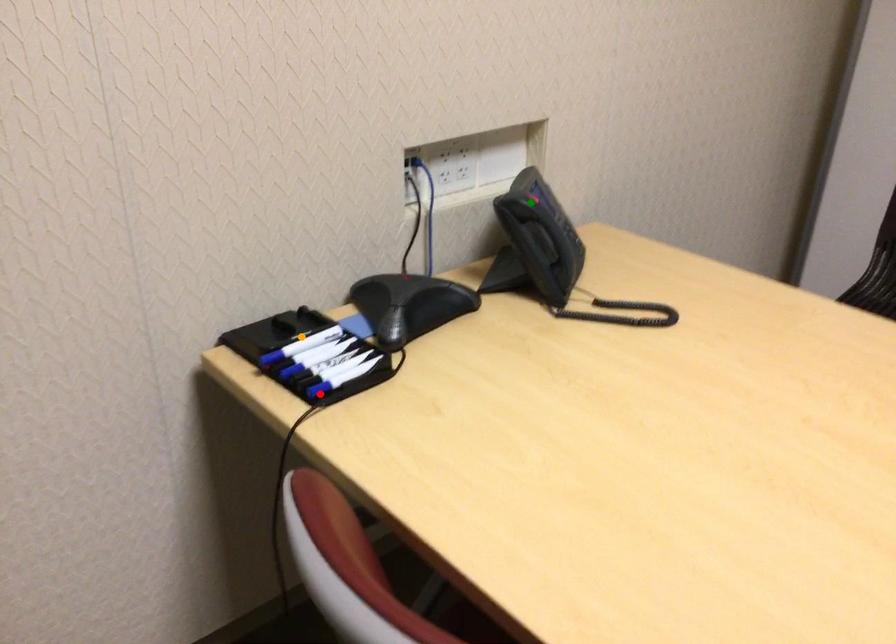
Order these from nearest to farthest:
A) green point
B) red point
C) orange point

red point → orange point → green point